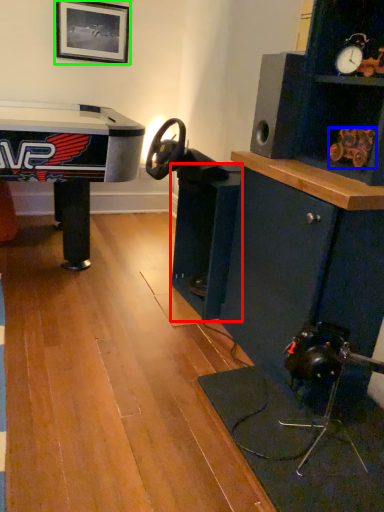
Question: Which is nearer to the shelf (highlighted by a red box)? toy (highlighted by a blue box) or picture frame (highlighted by a green box).

Choices:
 (A) toy
 (B) picture frame

Answer: (A)